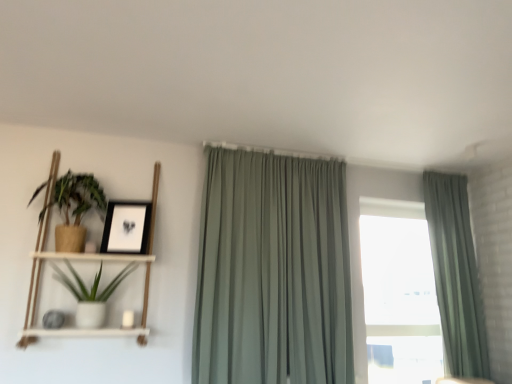
Locate an element on the screen. empty space that is ontop of sage green fabric curtain at right, which is counted as the first curtain, starting from the right (from a real-world perspective) is located at coordinates (446, 171).